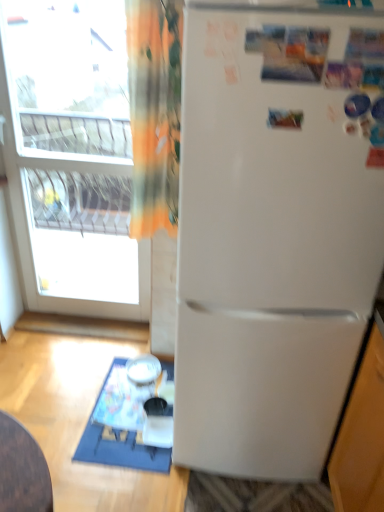
At what (x,y) coordinates should I click in order to perform the action: click on free space to the left of white matte refrigerator at center. Please return your answer as a coordinate pair (x, y). The width and height of the screenshot is (384, 512). Looking at the image, I should click on (101, 431).